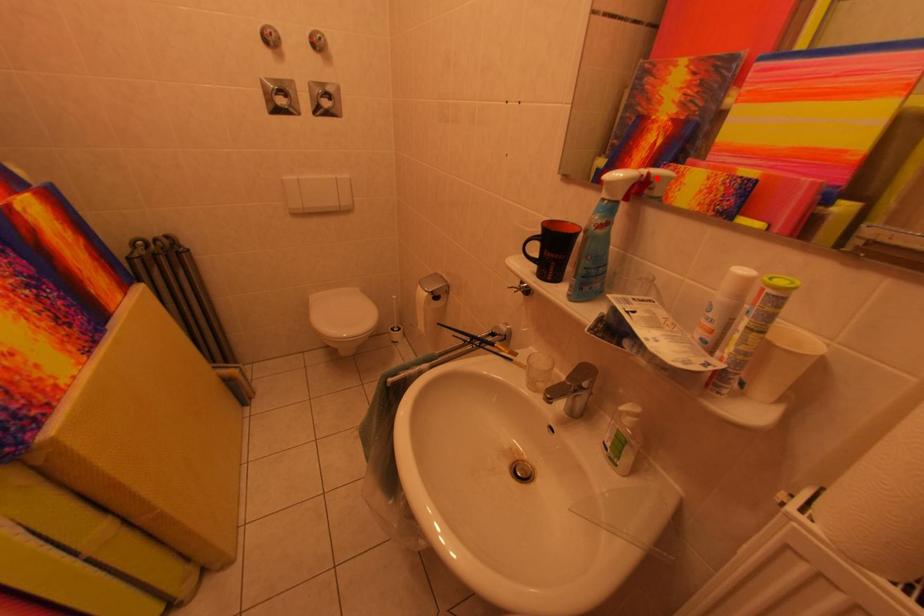
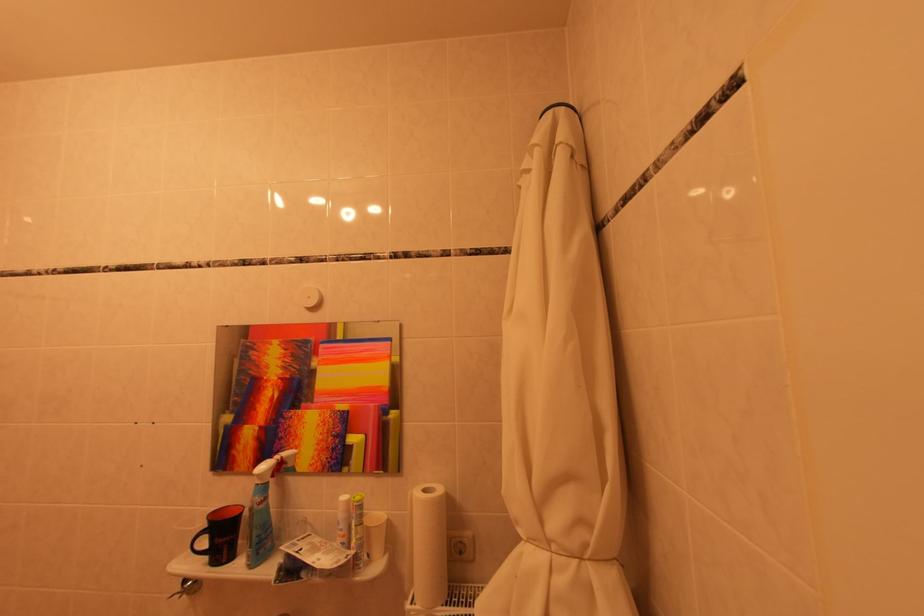
The point at the highlighted location is marked in the first image. Where is the corresponding point in the second image?

(290, 461)